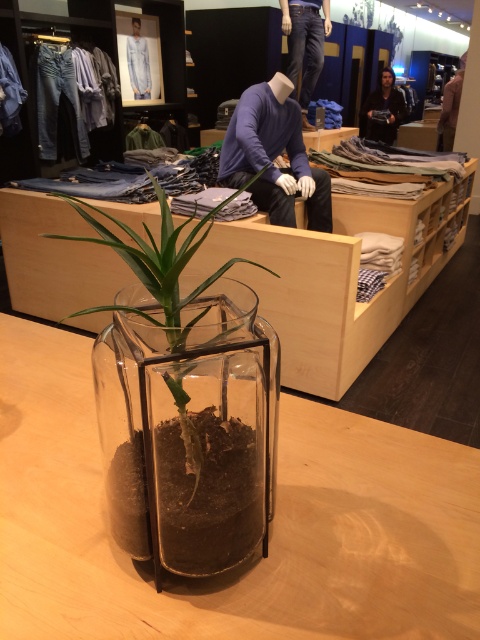
Question: Can you confirm if purple matte sweater at center is positioned to the right of brown leather jacket at upper right?

Choices:
 (A) no
 (B) yes

Answer: (A)

Question: Which object is farther from the camera taking this photo?

Choices:
 (A) clear glass terrarium at center
 (B) transparent glass vase at center
 (C) black leather jacket at upper center

Answer: (C)

Question: Is black leather jacket at upper center wider than brown leather jacket at upper right?

Choices:
 (A) no
 (B) yes

Answer: (B)

Question: Can you confirm if transparent glass vase at center is positioned to the left of black leather jacket at upper center?

Choices:
 (A) no
 (B) yes

Answer: (B)

Question: Which point is farther to the camera?

Choices:
 (A) (380, 125)
 (B) (445, 132)
 (C) (128, 298)
 (D) (283, 188)

Answer: (A)

Question: Which of the following is the closest to the observer?

Choices:
 (A) transparent glass table at center
 (B) black leather jacket at upper center
 (C) purple matte sweater at center

Answer: (A)